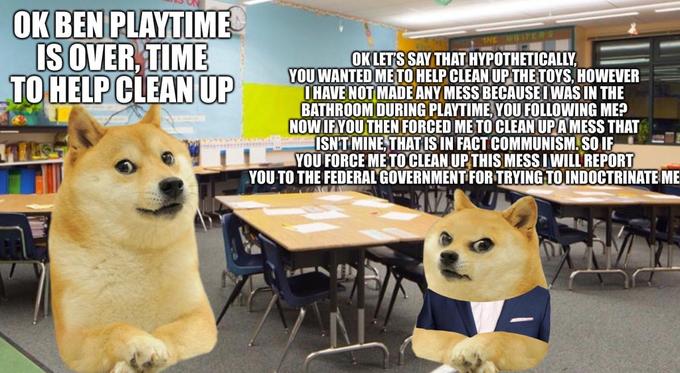
Find the location of a particular element. The image size is (680, 373). tables is located at coordinates (352, 225), (577, 199), (22, 205).